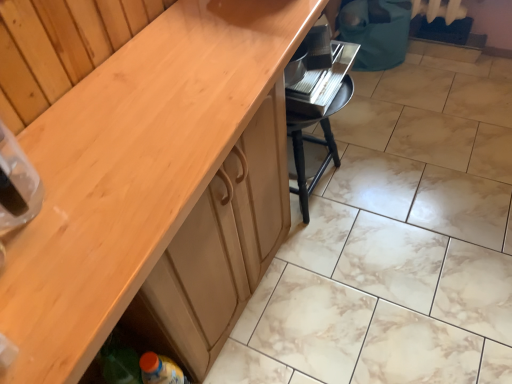
This screenshot has height=384, width=512. Describe the element at coordinates (157, 190) in the screenshot. I see `wooden cabinet at center` at that location.

I want to click on wooden cabinet at center, so click(157, 190).

Identify the location of wooden cabinet at center. click(x=157, y=190).